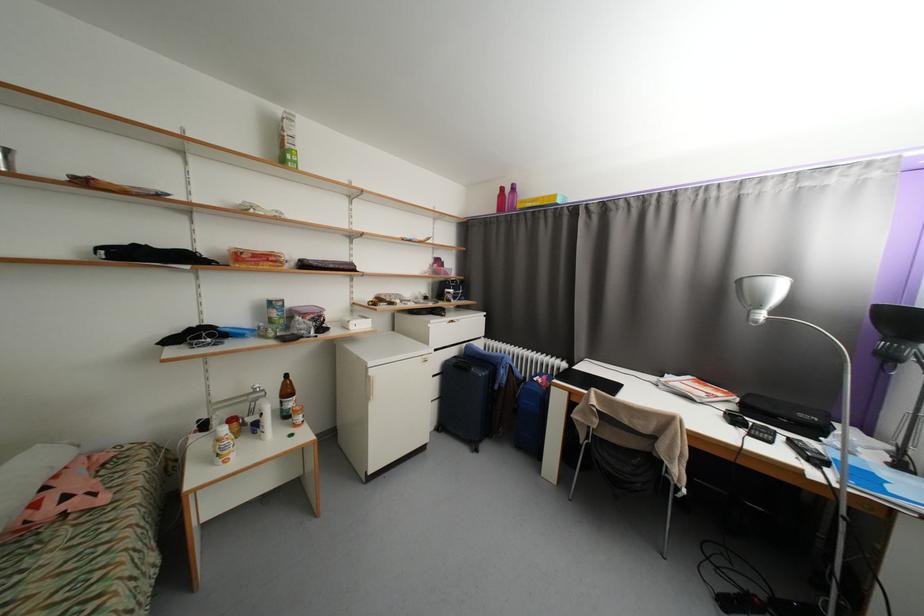
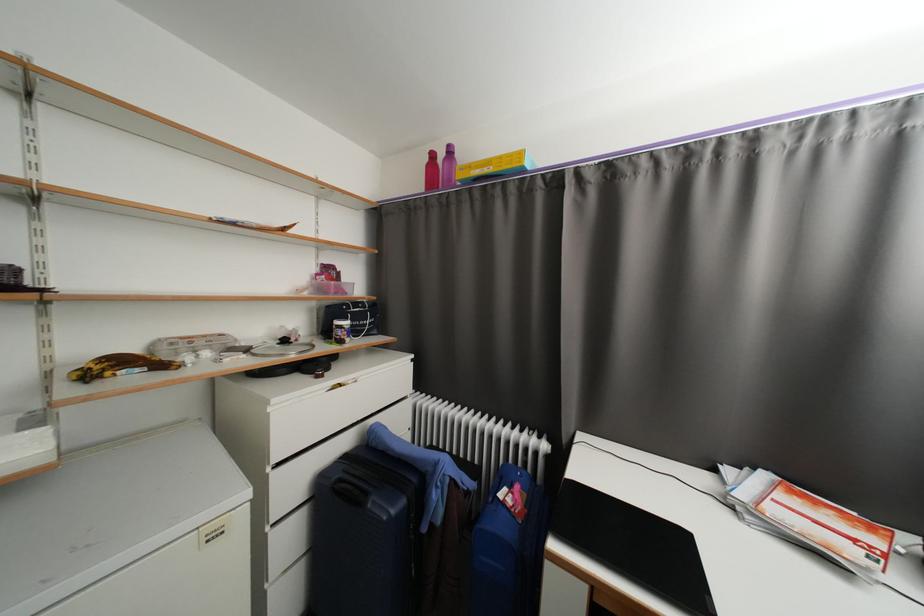
In the second image, find the point that corresponds to the point at 432,299 in the first image.

(290, 342)